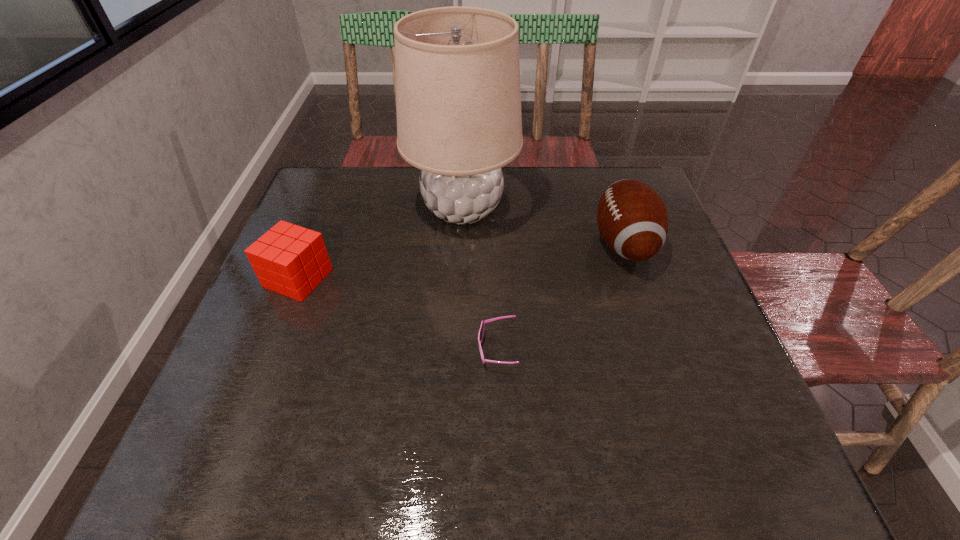
The image size is (960, 540). What are the coordinates of `the tallest object` in the screenshot? It's located at (458, 99).

I want to click on football, so click(632, 218).

The image size is (960, 540). Identify the location of the rightmost object. (632, 218).

Identify the location of cube. The width and height of the screenshot is (960, 540). (289, 259).

The image size is (960, 540). In order to click on the leftmost object in this screenshot , I will do `click(289, 259)`.

The image size is (960, 540). I want to click on the shortest object, so click(481, 332).

Locate an element on the screen. The height and width of the screenshot is (540, 960). the nearest object is located at coordinates (481, 332).

Where is `vacant space situated on the left of the tallest object`? vacant space situated on the left of the tallest object is located at coordinates (358, 208).

The width and height of the screenshot is (960, 540). I want to click on vacant space located 0.180m on the laces of the second tallest object, so click(522, 244).

Find the location of a particular element. This screenshot has width=960, height=540. blank space located on the laces of the second tallest object is located at coordinates (558, 244).